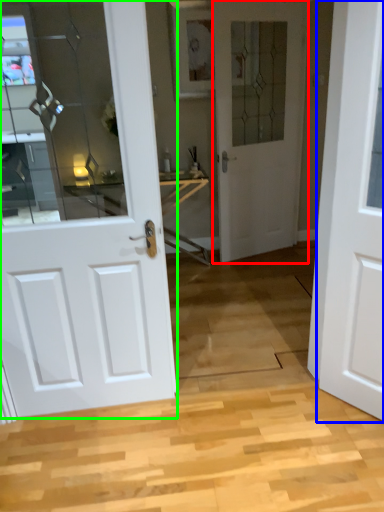
Question: Based on their relative distances, which object is farther from door (highlighted by a red box)? Choose from door (highlighted by a blue box) and door (highlighted by a green box).

Choices:
 (A) door
 (B) door

Answer: (B)